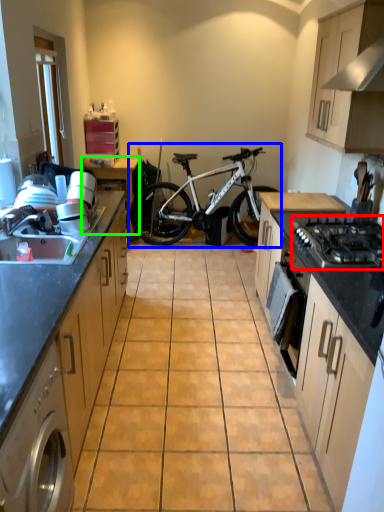
Question: Based on their relative distances, which object is farther from gas stove (highlighted by a red box)? Choose from bicycle (highlighted by a blue box) and table (highlighted by a green box).

Choices:
 (A) bicycle
 (B) table

Answer: (B)